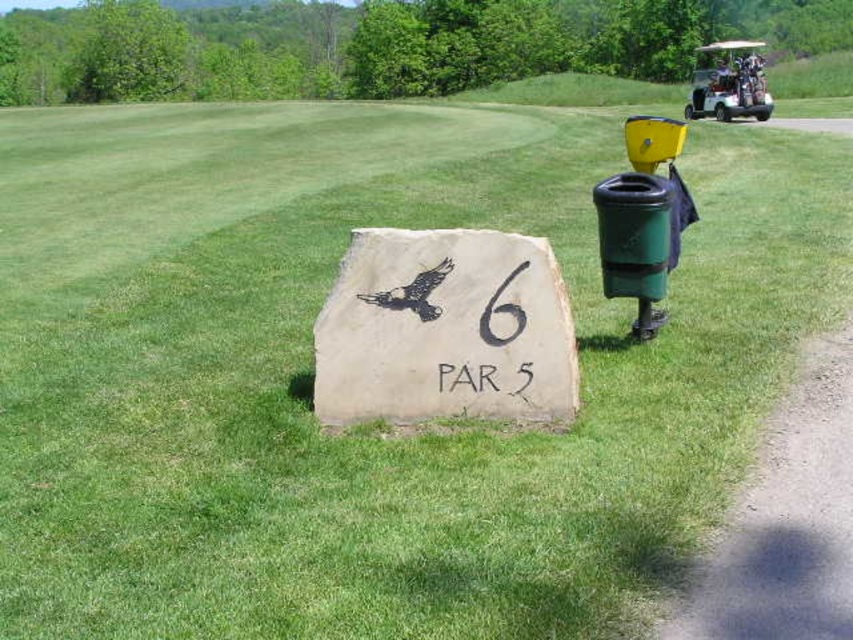
How much distance is there between natural stone sign at center and metallic silver golf cart at upper right?

natural stone sign at center is 22.01 meters away from metallic silver golf cart at upper right.

Who is more forward, (480, 410) or (759, 48)?

Point (480, 410) is in front.

Between point (326, 390) and point (732, 68), which one is positioned in front?

Point (326, 390) is in front.

At what (x,y) coordinates should I click in order to perform the action: click on natural stone sign at center. Please return your answer as a coordinate pair (x, y). The width and height of the screenshot is (853, 640). Looking at the image, I should click on (444, 330).